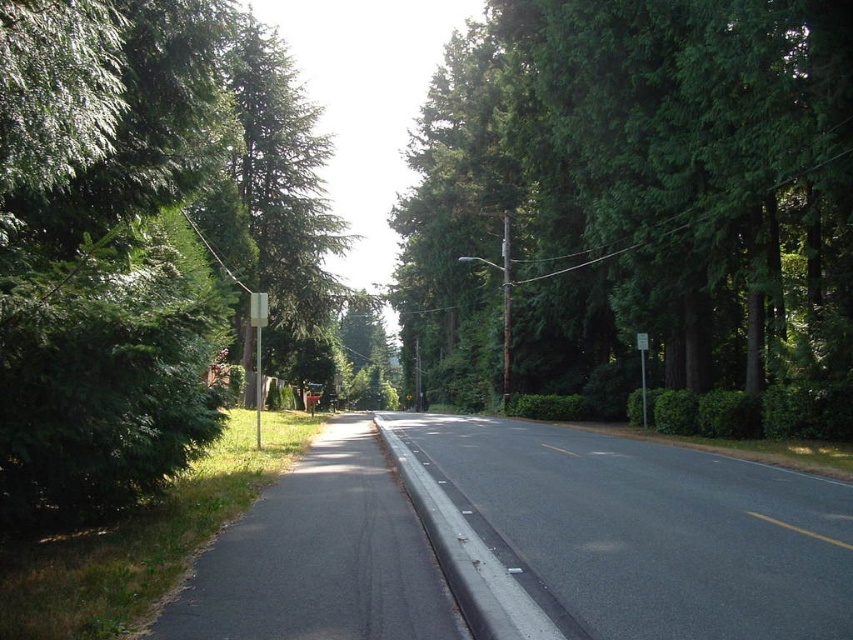
You are standing at the center of the road and want to place a new tree exactly where the green matte tree at left is currently located. Given that the road is straight and extends to the horizon, can you determine the coordinates where you should plant the new tree?

The coordinates for the green matte tree at left are at point (285, 198), so you should plant the new tree at those exact coordinates.

You are a pedestrian walking along the road and want to reach the white plastic sign at center. Which direction should you move to get there from the green matte tree at left?

The green matte tree at left is positioned on the left side of the white plastic sign at center, so you should move to the right to reach the white plastic sign at center from the green matte tree at left.